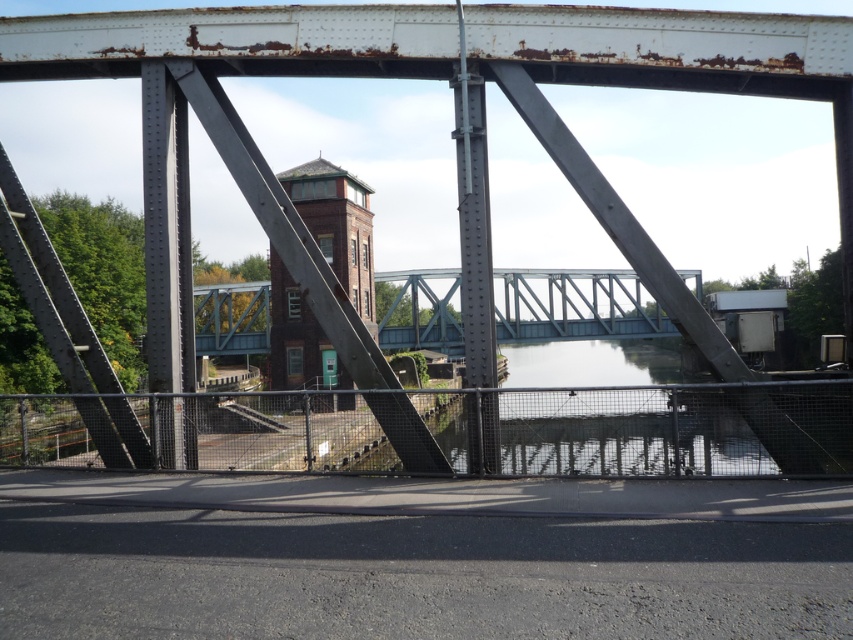
Between metallic gray bridge at center and brown brick tower at center, which one has less height?

With less height is metallic gray bridge at center.

Does metallic gray bridge at center have a greater width compared to brown brick tower at center?

Correct, the width of metallic gray bridge at center exceeds that of brown brick tower at center.

Where is `metallic gray bridge at center`? Image resolution: width=853 pixels, height=640 pixels. metallic gray bridge at center is located at coordinates [575, 305].

Is rusty metal train bridge at center bigger than metallic gray bridge at center?

No, rusty metal train bridge at center is not bigger than metallic gray bridge at center.

Between rusty metal train bridge at center and metallic gray bridge at center, which one has less height?

rusty metal train bridge at center

Who is more distant from viewer, (479,177) or (589,305)?

The point (589,305) is behind.

Locate an element on the screen. The width and height of the screenshot is (853, 640). rusty metal train bridge at center is located at coordinates [x=453, y=132].

Based on the photo, is rusty metal train bridge at center bigger than brown brick tower at center?

No, rusty metal train bridge at center is not bigger than brown brick tower at center.

Between point (323, 42) and point (279, 324), which one is positioned in front?

Positioned in front is point (323, 42).

Describe the element at coordinates (453, 132) in the screenshot. The height and width of the screenshot is (640, 853). I see `rusty metal train bridge at center` at that location.

Where is `rusty metal train bridge at center`? rusty metal train bridge at center is located at coordinates (453, 132).